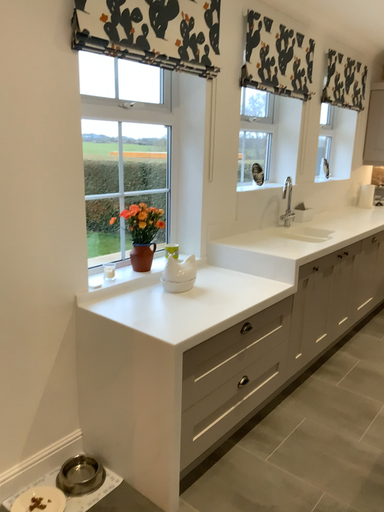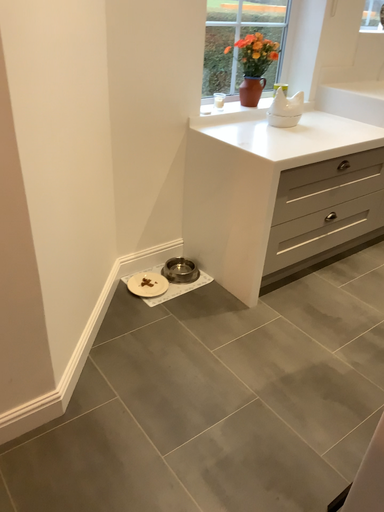
Question: Which way did the camera rotate in the video?

Choices:
 (A) rotated upward
 (B) rotated downward

Answer: (B)